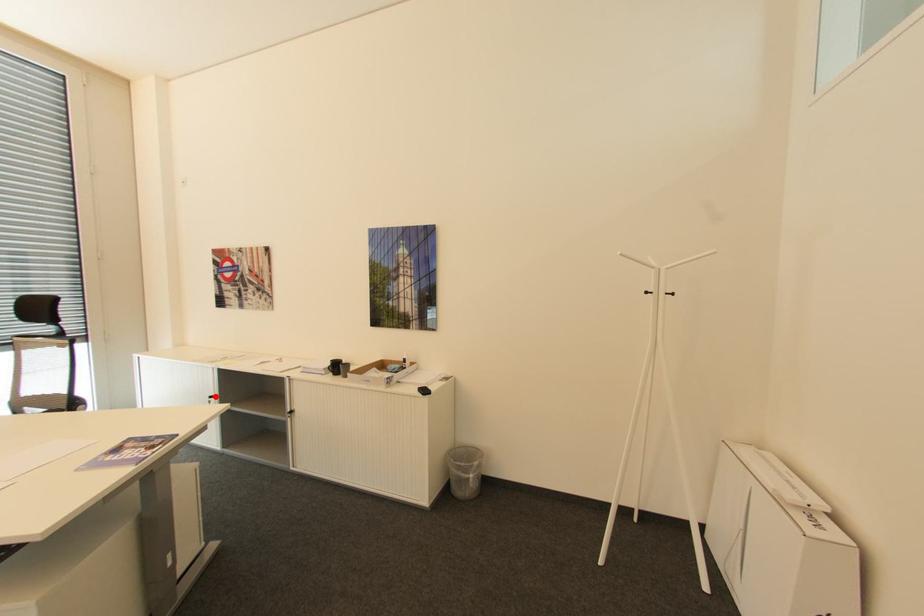
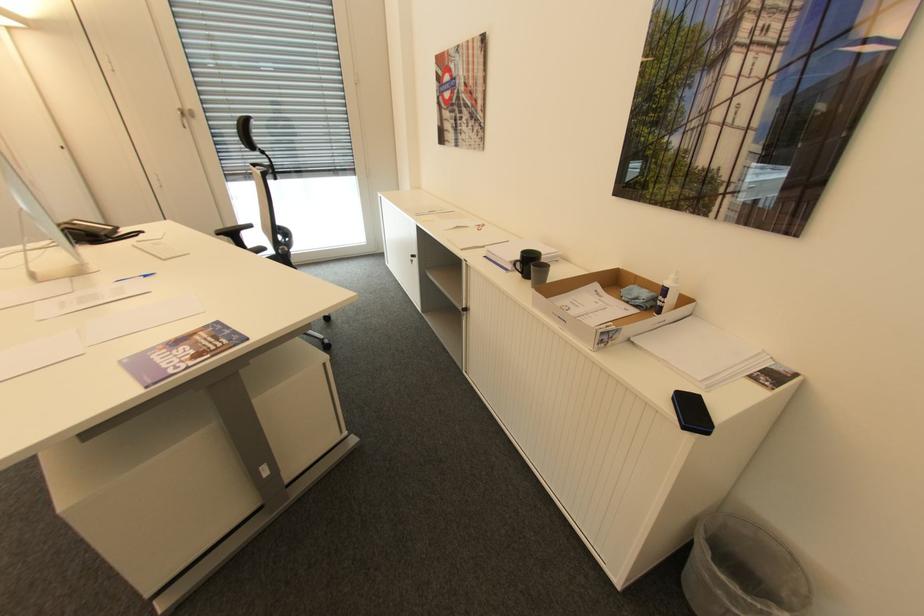
Question: A red point is marked in image1. In image2, is the corresponding 3D point closer to the camera or farther? Reply with the corresponding letter.

Choices:
 (A) The corresponding 3D point is closer.
 (B) The corresponding 3D point is farther.

Answer: (A)